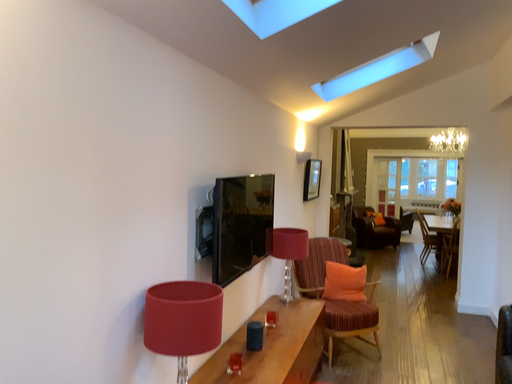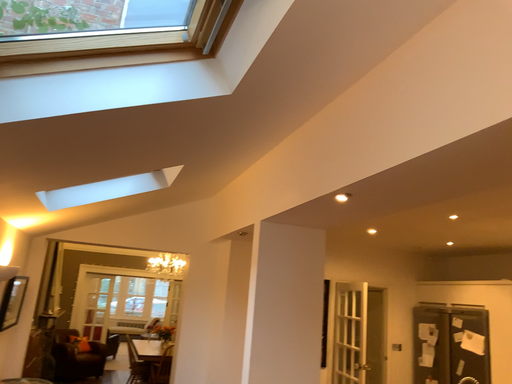
Question: Which way did the camera rotate in the video?

Choices:
 (A) rotated right
 (B) rotated left

Answer: (A)